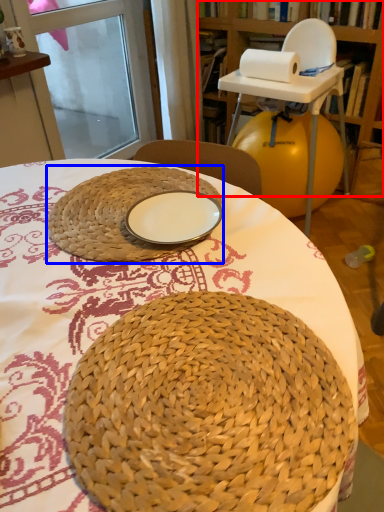
Question: Which object appears farthest to the camera in this image, bookshelf (highlighted by a red box) or basket (highlighted by a blue box)?

Choices:
 (A) bookshelf
 (B) basket

Answer: (A)